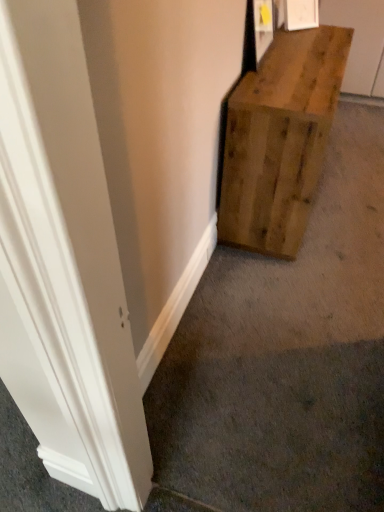
Question: From the image's perspective, is natural wood crate at center-right under natural wood bench at right?

Choices:
 (A) no
 (B) yes

Answer: (B)

Question: Does natural wood crate at center-right appear on the left side of natural wood bench at right?

Choices:
 (A) no
 (B) yes

Answer: (B)

Question: Considering the relative sizes of natural wood crate at center-right and natural wood bench at right in the image provided, is natural wood crate at center-right wider than natural wood bench at right?

Choices:
 (A) no
 (B) yes

Answer: (A)

Question: Does natural wood crate at center-right have a smaller size compared to natural wood bench at right?

Choices:
 (A) no
 (B) yes

Answer: (B)

Question: Are natural wood crate at center-right and natural wood bench at right beside each other?

Choices:
 (A) yes
 (B) no

Answer: (B)

Question: Is the depth of natural wood crate at center-right greater than that of natural wood bench at right?

Choices:
 (A) yes
 (B) no

Answer: (B)

Question: From a real-world perspective, does natural wood bench at right sit lower than natural wood crate at center-right?

Choices:
 (A) yes
 (B) no

Answer: (A)

Question: Considering the relative sizes of natural wood bench at right and natural wood crate at center-right in the image provided, is natural wood bench at right thinner than natural wood crate at center-right?

Choices:
 (A) yes
 (B) no

Answer: (B)

Question: Is natural wood bench at right further to camera compared to natural wood crate at center-right?

Choices:
 (A) yes
 (B) no

Answer: (A)

Question: Is natural wood bench at right wider than natural wood crate at center-right?

Choices:
 (A) no
 (B) yes

Answer: (B)

Question: From a real-world perspective, is natural wood bench at right physically above natural wood crate at center-right?

Choices:
 (A) no
 (B) yes

Answer: (A)

Question: Is natural wood bench at right in contact with natural wood crate at center-right?

Choices:
 (A) yes
 (B) no

Answer: (B)

Question: In the image, is natural wood bench at right on the left side or the right side of natural wood crate at center-right?

Choices:
 (A) right
 (B) left

Answer: (A)